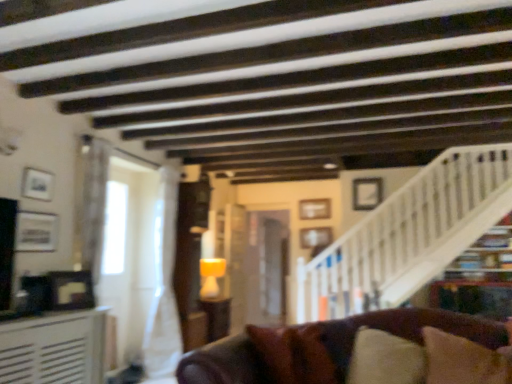
Question: Is matte silver picture frame at left, marked as the 2th picture frame in a left-to-right arrangement, not within white matte picture frame at upper right, the 5th picture frame when ordered from left to right?

Choices:
 (A) yes
 (B) no

Answer: (A)

Question: Is matte silver picture frame at left, the first picture frame viewed from the front, closer to the viewer compared to white matte picture frame at upper right, which ranks as the 3th picture frame in front-to-back order?

Choices:
 (A) yes
 (B) no

Answer: (A)

Question: Is matte silver picture frame at left, placed as the 5th picture frame when sorted from back to front, far away from white matte picture frame at upper right, the third picture frame positioned from the back?

Choices:
 (A) yes
 (B) no

Answer: (A)

Question: Is matte silver picture frame at left, marked as the 2th picture frame in a left-to-right arrangement, to the left of white matte picture frame at upper right, the third picture frame positioned from the back, from the viewer's perspective?

Choices:
 (A) no
 (B) yes

Answer: (B)

Question: Can you confirm if matte silver picture frame at left, the first picture frame viewed from the front, is shorter than white matte picture frame at upper right, the 5th picture frame when ordered from left to right?

Choices:
 (A) no
 (B) yes

Answer: (B)

Question: From the image's perspective, is white textured table at left, the 1th table in the front-to-back sequence, above or below brown fabric pillow at lower right?

Choices:
 (A) above
 (B) below

Answer: (B)

Question: Does point (87, 352) appear closer or farther from the camera than point (431, 382)?

Choices:
 (A) farther
 (B) closer

Answer: (A)

Question: In the image, is white textured table at left, the 1th table in the front-to-back sequence, positioned in front of or behind brown fabric pillow at lower right?

Choices:
 (A) front
 (B) behind

Answer: (B)

Question: Is white textured table at left, which is the second table in back-to-front order, situated inside brown fabric pillow at lower right or outside?

Choices:
 (A) inside
 (B) outside

Answer: (B)

Question: Is point (317, 244) closer or farther from the camera than point (220, 301)?

Choices:
 (A) closer
 (B) farther

Answer: (A)

Question: In terms of height, does wooden picture frame at center, positioned as the 4th picture frame in left-to-right order, look taller or shorter compared to matte brown table at center, which is counted as the first table, starting from the right?

Choices:
 (A) short
 (B) tall

Answer: (A)

Question: Is wooden picture frame at center, positioned as the 4th picture frame in left-to-right order, wider or thinner than matte brown table at center, which is counted as the first table, starting from the right?

Choices:
 (A) wide
 (B) thin

Answer: (B)

Question: Choose the correct answer: Is wooden picture frame at center, positioned as the 4th picture frame in left-to-right order, inside matte brown table at center, which is counted as the second table, starting from the left, or outside it?

Choices:
 (A) outside
 (B) inside

Answer: (A)

Question: Relative to white matte picture frame at upper right, which ranks as the 3th picture frame in front-to-back order, is matte silver picture frame at left, marked as the 2th picture frame in a left-to-right arrangement, in front or behind?

Choices:
 (A) behind
 (B) front

Answer: (B)

Question: In the image, is matte silver picture frame at left, placed as the 5th picture frame when sorted from back to front, on the left side or the right side of white matte picture frame at upper right, which is the first picture frame from right to left?

Choices:
 (A) right
 (B) left

Answer: (B)